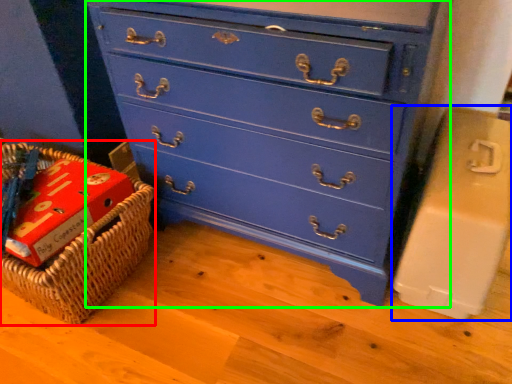
Question: Which is nearer to the basket (highlighted by a red box)? cardboard box (highlighted by a blue box) or chest of drawers (highlighted by a green box).

Choices:
 (A) cardboard box
 (B) chest of drawers

Answer: (B)